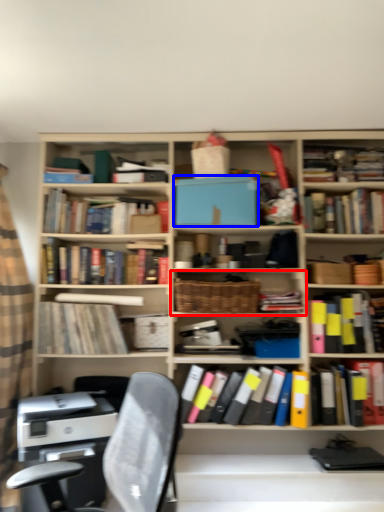
Question: Which object appears farthest to the camera in this image, shelf (highlighted by a red box) or paperback book (highlighted by a blue box)?

Choices:
 (A) shelf
 (B) paperback book

Answer: (B)